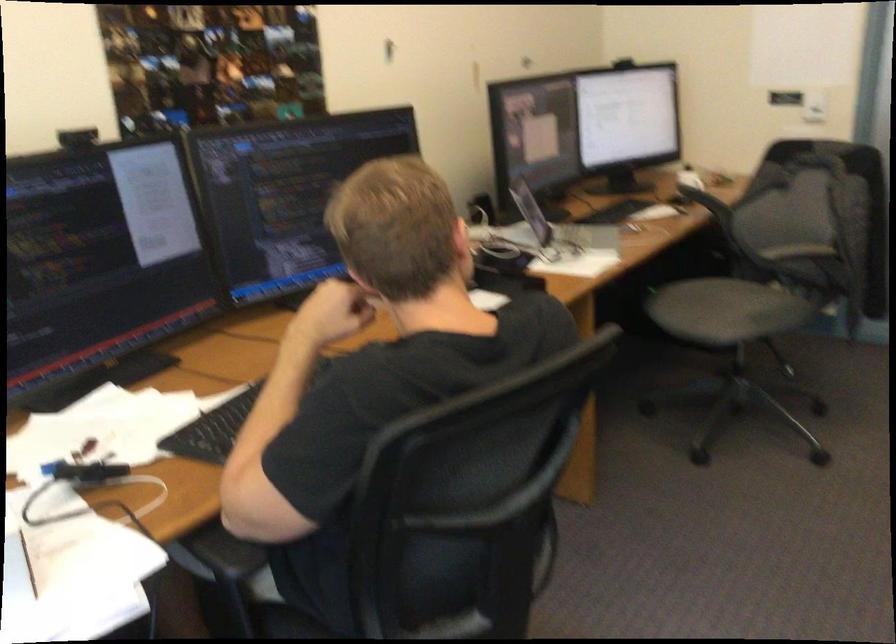
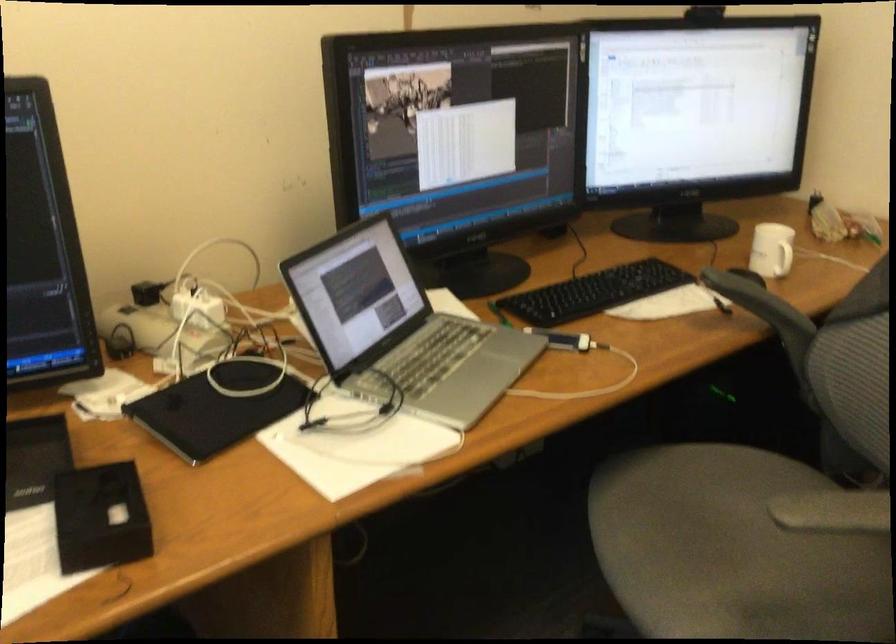
The point at [728,301] is marked in the first image. Where is the corresponding point in the second image?

(733, 550)